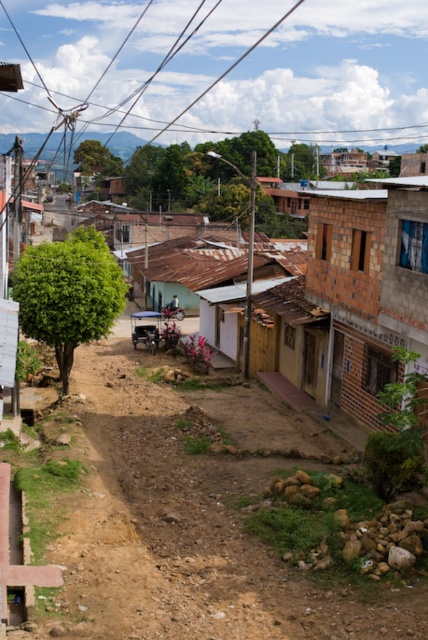
You are a delivery person trying to reach the brick wall house at right. The brown dirt track at center is the only path available. Based on the scene, can you determine if the track is directly in front of the house, making it the correct path to take?

The brown dirt track at center is in front of the brick wall house at right, so yes, the track is directly in front of the house and is the correct path to take.

You are a delivery person with a cart that is 2 meters wide. You need to navigate through the brown dirt track at center and pass by the brick wall house at right. Can your cart fit through the dirt track without touching the sides?

The brown dirt track at center is wider than the brick wall house at right, so the cart which is 2 meters wide can fit through the dirt track without touching the sides.